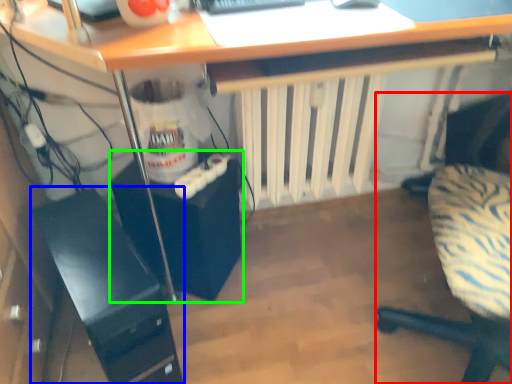
Question: Which object is positioned farthest from chair (highlighted by a red box)? Select from computer tower (highlighted by a blue box) and computer tower (highlighted by a green box).

Choices:
 (A) computer tower
 (B) computer tower

Answer: (A)